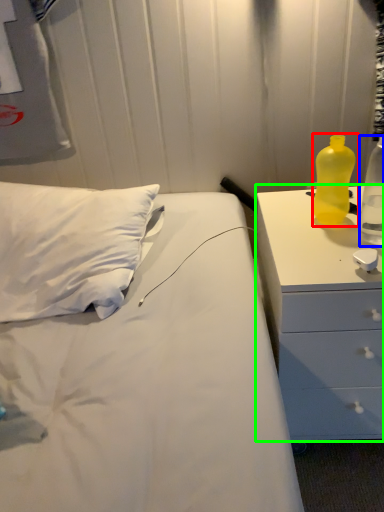
Question: Which is farther away from bottle (highlighted by a red box)? bottle (highlighted by a blue box) or chest of drawers (highlighted by a green box)?

Choices:
 (A) bottle
 (B) chest of drawers

Answer: (B)